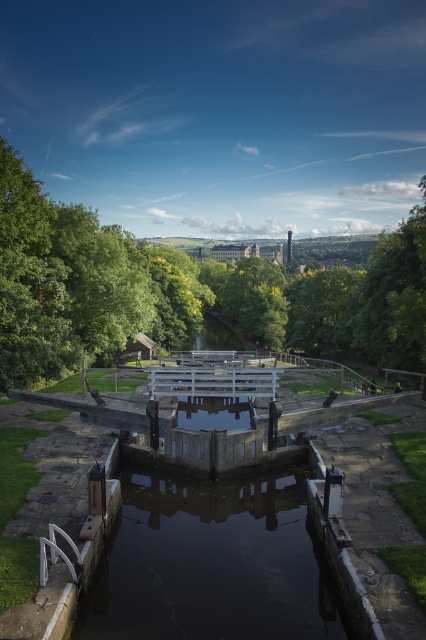
You are a visitor at the canal lock system and want to take a photo that includes both the green leafy tree at center and the dark concrete water at center. Which object should you focus on first to ensure both are in frame?

You should focus on the green leafy tree at center first because it has a larger size compared to the dark concrete water at center, so it will occupy more space in the photo and ensure both are included.

You are standing on the grassy path near the lock gates and see the green leafy tree at center and the dark concrete water at center. Which object is closer to you?

The green leafy tree at center is closer to you because the dark concrete water at center is behind it.

You are standing at the entrance of the canal lock system and want to find the green leafy tree at center. According to the coordinates provided, where should you look relative to your current position?

The green leafy tree at center is located at coordinates point (181, 291), which means it is positioned slightly to the right and ahead of your current position at the entrance.